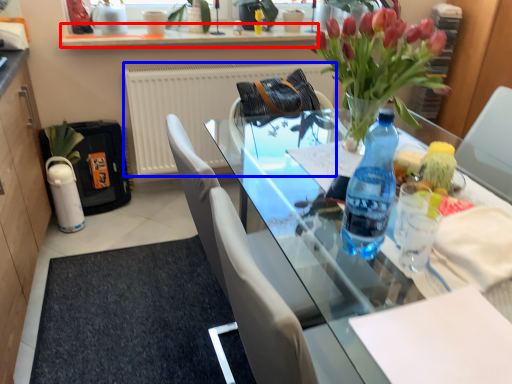
Question: Among these objects, which one is nearest to the camera, window sill (highlighted by a red box) or radiator (highlighted by a blue box)?

Choices:
 (A) window sill
 (B) radiator

Answer: (A)